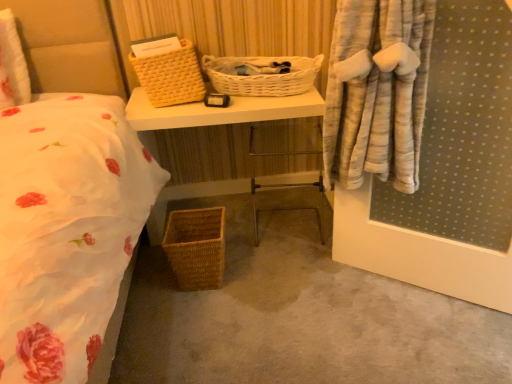
Question: Would you say yellow woven picnic basket at upper center, the 3th picnic basket positioned from the bottom, contains woven brown picnic basket at lower center, the third picnic basket viewed from the top?

Choices:
 (A) yes
 (B) no

Answer: (B)

Question: From a real-world perspective, does yellow woven picnic basket at upper center, the 1th picnic basket positioned from the top, stand above woven brown picnic basket at lower center, the 1th picnic basket from the bottom?

Choices:
 (A) no
 (B) yes

Answer: (B)

Question: Is yellow woven picnic basket at upper center, the 3th picnic basket positioned from the bottom, outside woven brown picnic basket at lower center, the third picnic basket viewed from the top?

Choices:
 (A) yes
 (B) no

Answer: (A)

Question: From the image's perspective, does yellow woven picnic basket at upper center, the 1th picnic basket positioned from the top, appear lower than woven brown picnic basket at lower center, the 1th picnic basket from the bottom?

Choices:
 (A) yes
 (B) no

Answer: (B)

Question: Is yellow woven picnic basket at upper center, the 1th picnic basket positioned from the top, closer to camera compared to woven brown picnic basket at lower center, the third picnic basket viewed from the top?

Choices:
 (A) no
 (B) yes

Answer: (B)

Question: Is point (224, 87) positioned closer to the camera than point (310, 182)?

Choices:
 (A) farther
 (B) closer

Answer: (B)

Question: Considering the positions of white wicker picnic basket at center, marked as the second picnic basket in a bottom-to-top arrangement, and metallic silver chair at center in the image, is white wicker picnic basket at center, marked as the second picnic basket in a bottom-to-top arrangement, taller or shorter than metallic silver chair at center?

Choices:
 (A) short
 (B) tall

Answer: (A)

Question: Visually, is white wicker picnic basket at center, the second picnic basket when ordered from top to bottom, positioned to the left or to the right of metallic silver chair at center?

Choices:
 (A) right
 (B) left

Answer: (B)

Question: From a real-world perspective, relative to metallic silver chair at center, is white wicker picnic basket at center, the second picnic basket when ordered from top to bottom, vertically above or below?

Choices:
 (A) above
 (B) below

Answer: (A)

Question: Is yellow woven picnic basket at upper center, the 3th picnic basket positioned from the bottom, bigger or smaller than woven basket at lower left?

Choices:
 (A) big
 (B) small

Answer: (B)

Question: Which is correct: yellow woven picnic basket at upper center, the 1th picnic basket positioned from the top, is inside woven basket at lower left, or outside of it?

Choices:
 (A) outside
 (B) inside

Answer: (A)

Question: From a real-world perspective, is yellow woven picnic basket at upper center, the 3th picnic basket positioned from the bottom, positioned above or below woven basket at lower left?

Choices:
 (A) below
 (B) above

Answer: (B)

Question: In terms of width, does yellow woven picnic basket at upper center, the 1th picnic basket positioned from the top, look wider or thinner when compared to woven basket at lower left?

Choices:
 (A) thin
 (B) wide

Answer: (A)

Question: Looking at the image, does metallic silver chair at center seem bigger or smaller compared to woven brown picnic basket at lower center, the 1th picnic basket from the bottom?

Choices:
 (A) big
 (B) small

Answer: (A)

Question: Is metallic silver chair at center spatially inside woven brown picnic basket at lower center, the 1th picnic basket from the bottom, or outside of it?

Choices:
 (A) outside
 (B) inside

Answer: (A)